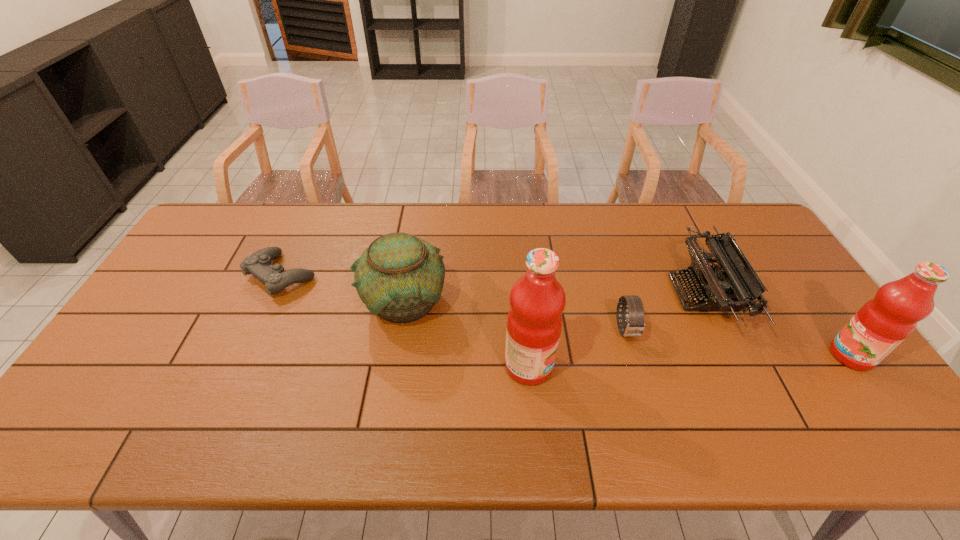
I want to click on vacant region between the typewriter and the right fruit juice, so click(777, 325).

At what (x,y) coordinates should I click in order to perform the action: click on free spot between the taller fruit juice and the fifth tallest object. Please return your answer as a coordinate pair (x, y). The width and height of the screenshot is (960, 540). Looking at the image, I should click on (577, 348).

Locate an element on the screen. The height and width of the screenshot is (540, 960). vacant region between the third tallest object and the taller fruit juice is located at coordinates (467, 333).

Where is `unoccupied area between the leftmost object and the pottery`? The width and height of the screenshot is (960, 540). unoccupied area between the leftmost object and the pottery is located at coordinates (343, 288).

Identify which object is located as the third nearest to the fourth object from left to right. Please provide its 2D coordinates. Your answer should be formatted as a tuple, i.e. [(x, y)], where the tuple contains the x and y coordinates of a point satisfying the conditions above.

[(399, 277)]

Find the location of `object that is the third closest to the fifth shortest object`. object that is the third closest to the fifth shortest object is located at coordinates (537, 300).

Image resolution: width=960 pixels, height=540 pixels. Find the location of `free location that satisfies the following two spatial constraints: 1. on the face of the second shortest object; 2. on the front label of the taller fruit juice`. free location that satisfies the following two spatial constraints: 1. on the face of the second shortest object; 2. on the front label of the taller fruit juice is located at coordinates (636, 366).

Locate an element on the screen. Image resolution: width=960 pixels, height=540 pixels. blank space that satisfies the following two spatial constraints: 1. on the face of the watch; 2. on the front label of the tallest object is located at coordinates (636, 366).